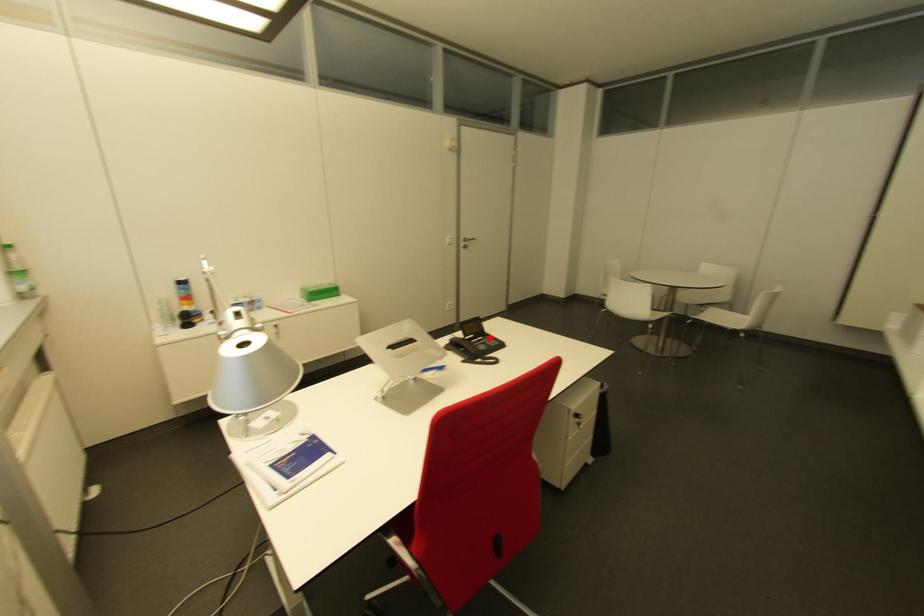
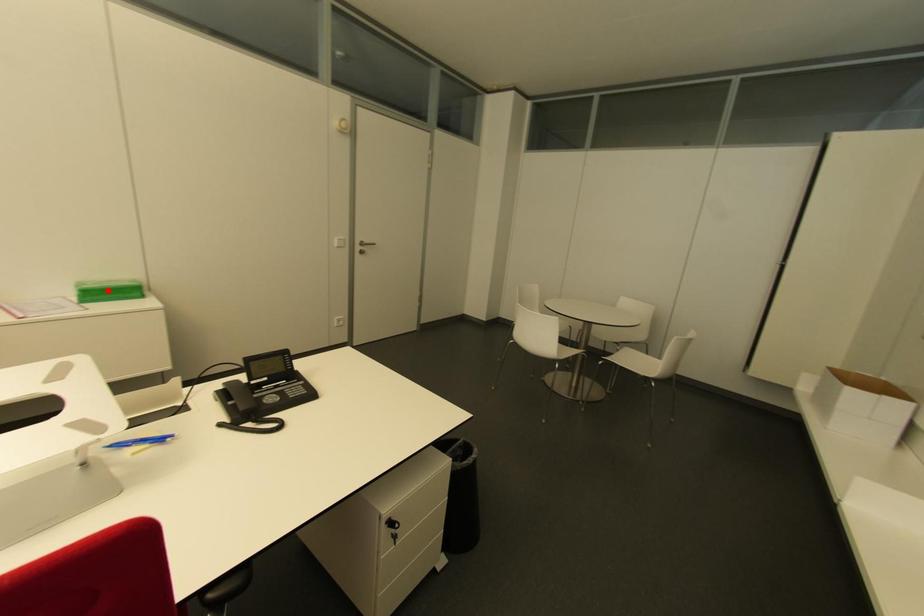
In the scene shown: I am providing you with two images of the same scene from different viewpoints. A red point is marked on the first image and another point is marked on the second image. Is the marked point in image1 the same physical position as the marked point in image2?

No